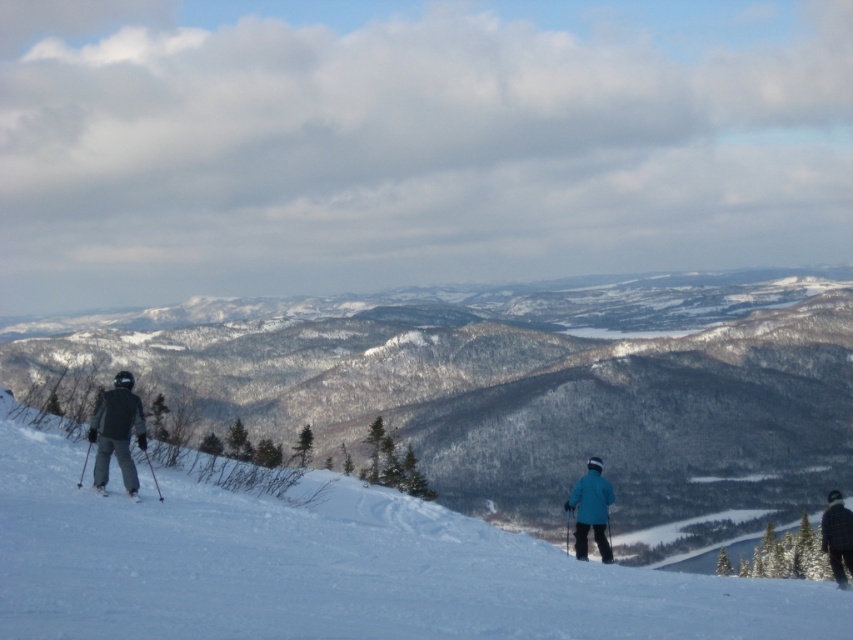
How distant is plaid wool jacket at lower right from matte black ski at lower left?

plaid wool jacket at lower right and matte black ski at lower left are 70.92 meters apart from each other.

Can you confirm if plaid wool jacket at lower right is bigger than matte black ski at lower left?

Correct, plaid wool jacket at lower right is larger in size than matte black ski at lower left.

Which is behind, point (849, 552) or point (105, 493)?

The point (849, 552) is more distant.

The height and width of the screenshot is (640, 853). What are the coordinates of `plaid wool jacket at lower right` in the screenshot? It's located at (837, 536).

This screenshot has width=853, height=640. Describe the element at coordinates (115, 433) in the screenshot. I see `dark gray ski suit at left` at that location.

The height and width of the screenshot is (640, 853). I want to click on dark gray ski suit at left, so click(x=115, y=433).

Is blue matte jacket at lower center smaller than plaid wool jacket at lower right?

Yes.

Locate an element on the screen. The height and width of the screenshot is (640, 853). blue matte jacket at lower center is located at coordinates (590, 509).